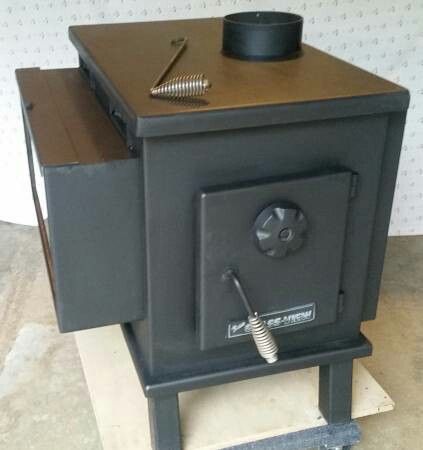
Find the location of a particular element. The image size is (423, 450). handle is located at coordinates [x=254, y=341].